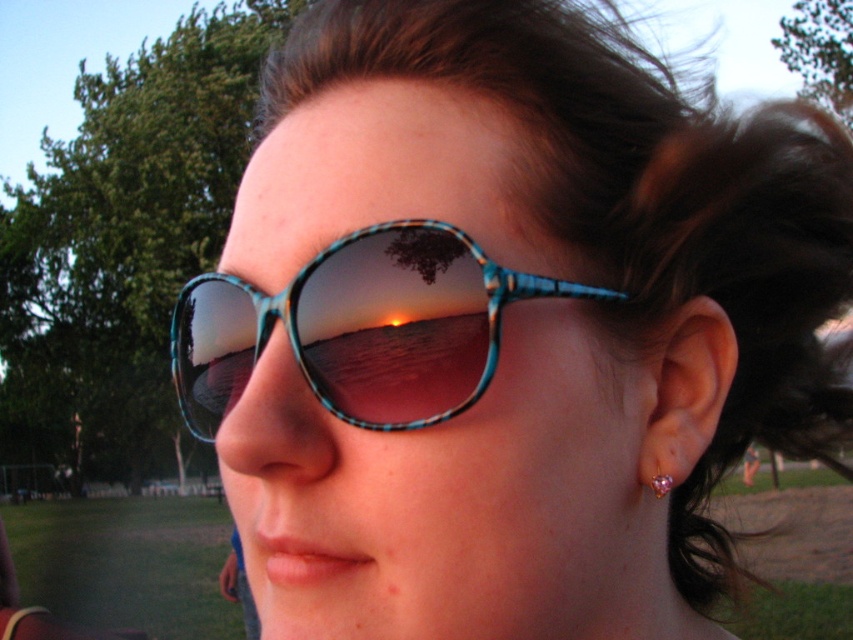
Question: Which object is closer to the camera taking this photo?

Choices:
 (A) brown shiny hair at upper center
 (B) pink gemstone earring at ear
 (C) teal glossy sunglasses at center

Answer: (C)

Question: Among these points, which one is nearest to the camera?

Choices:
 (A) (782, 419)
 (B) (276, 310)
 (C) (663, 480)

Answer: (B)

Question: Can you confirm if teal glossy sunglasses at center is positioned below pink gemstone earring at ear?

Choices:
 (A) yes
 (B) no

Answer: (B)

Question: Is brown shiny hair at upper center behind teal glossy sunglasses at center?

Choices:
 (A) no
 (B) yes

Answer: (B)

Question: Is brown shiny hair at upper center smaller than pink gemstone earring at ear?

Choices:
 (A) yes
 (B) no

Answer: (B)

Question: Which point is farther to the camera?

Choices:
 (A) (225, 337)
 (B) (538, 65)

Answer: (A)